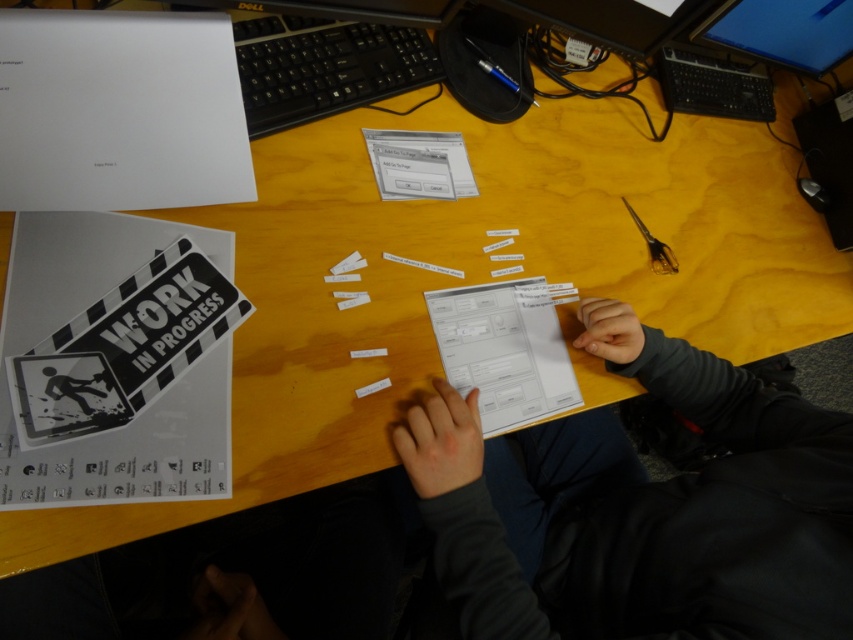
Can you confirm if dark gray sweater at center is bigger than black plastic keyboard at upper center?

Yes.

Identify the location of dark gray sweater at center. (653, 513).

At what (x,y) coordinates should I click in order to perform the action: click on dark gray sweater at center. Please return your answer as a coordinate pair (x, y). The image size is (853, 640). Looking at the image, I should click on (653, 513).

Can you confirm if matte black monitor at upper right is smaller than black glossy poster at center?

No.

Which is behind, point (816, 38) or point (70, 406)?

The point (816, 38) is more distant.

Locate an element on the screen. The height and width of the screenshot is (640, 853). matte black monitor at upper right is located at coordinates (784, 32).

The image size is (853, 640). Identify the location of matte black monitor at upper right. (784, 32).

Is dark gray sweater at center positioned behind black glossy poster at center?

No.

You are a GUI agent. You are given a task and a screenshot of the screen. Output one action in this format:
    pyautogui.click(x=<x>, y=<y>)
    Task: Click on the dark gray sweater at center
    This screenshot has width=853, height=640.
    Given the screenshot: What is the action you would take?
    pyautogui.click(x=653, y=513)

Identify the location of dark gray sweater at center. This screenshot has width=853, height=640. (653, 513).